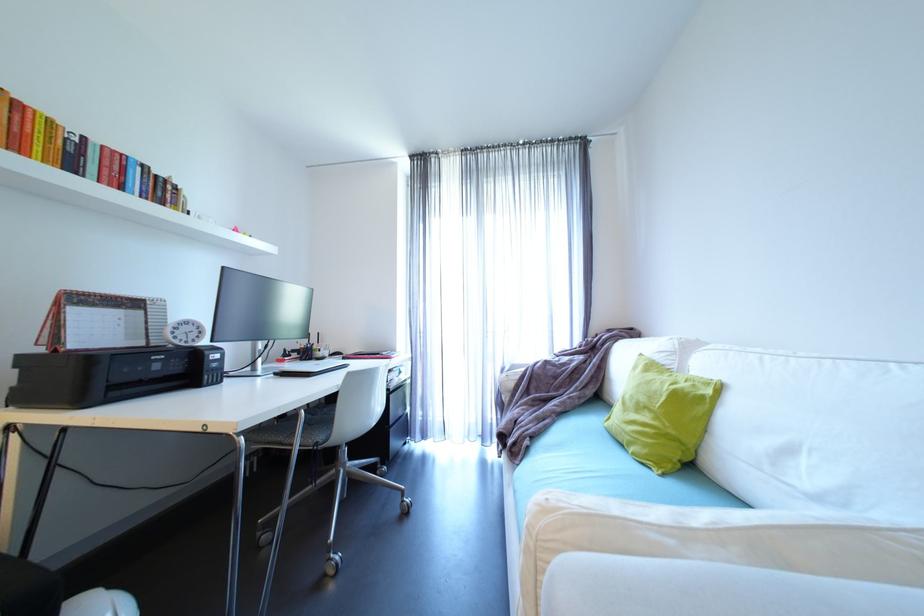
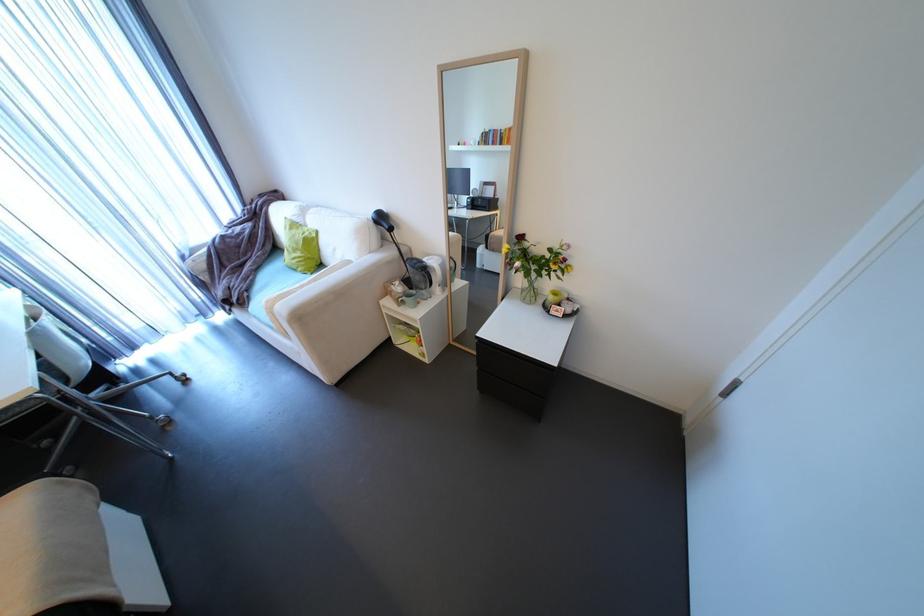
Where in the second image is the point corresponding to (521,450) from the first image?

(248, 302)